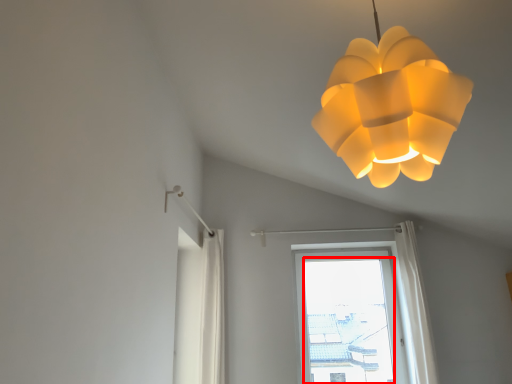
Question: From the image's perspective, what is the correct spatial positioning of window screen (annotated by the red box) in reference to lamp?

Choices:
 (A) above
 (B) below

Answer: (B)